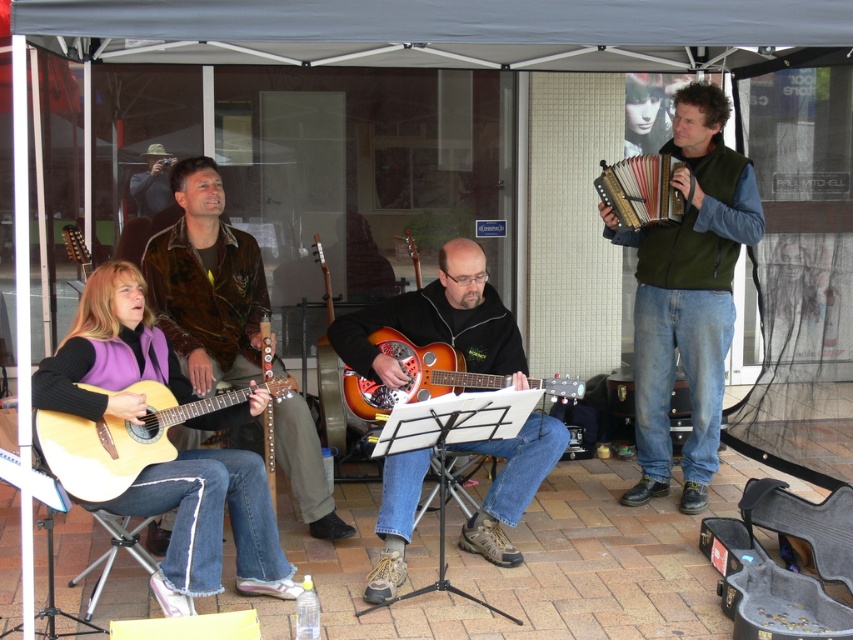
Image resolution: width=853 pixels, height=640 pixels. What do you see at coordinates (209, 524) in the screenshot?
I see `matte purple vest at lower left` at bounding box center [209, 524].

Is matte purple vest at lower left shorter than brushed leather jacket at upper left?

Yes, matte purple vest at lower left is shorter than brushed leather jacket at upper left.

Where is `matte purple vest at lower left`? The image size is (853, 640). matte purple vest at lower left is located at coordinates (209, 524).

How distant is brushed leather jacket at upper left from wooden accordion at upper right?

1.92 meters

Who is more distant from viewer, [189,365] or [605,170]?

Positioned behind is point [605,170].

Does point (173, 260) come farther from viewer compared to point (660, 198)?

No, it is not.

Where is `brushed leather jacket at upper left`? brushed leather jacket at upper left is located at coordinates (206, 282).

Where is `light brown acoustic guitar at lower left`? light brown acoustic guitar at lower left is located at coordinates (117, 440).

What are the coordinates of `light brown acoustic guitar at lower left` in the screenshot? It's located at (117, 440).

Image resolution: width=853 pixels, height=640 pixels. Identify the location of light brown acoustic guitar at lower left. (117, 440).